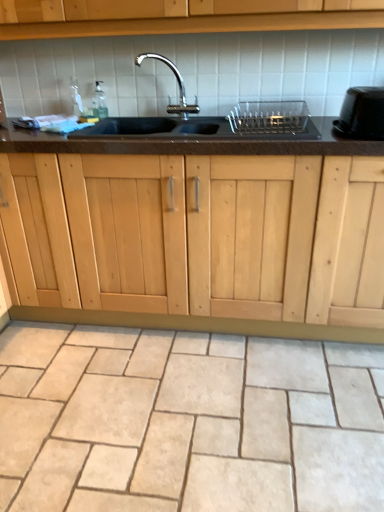
Find the location of a particular element. This screenshot has height=512, width=384. vacant area on top of beige stone tile at lower center (from a real-world perspective) is located at coordinates (180, 392).